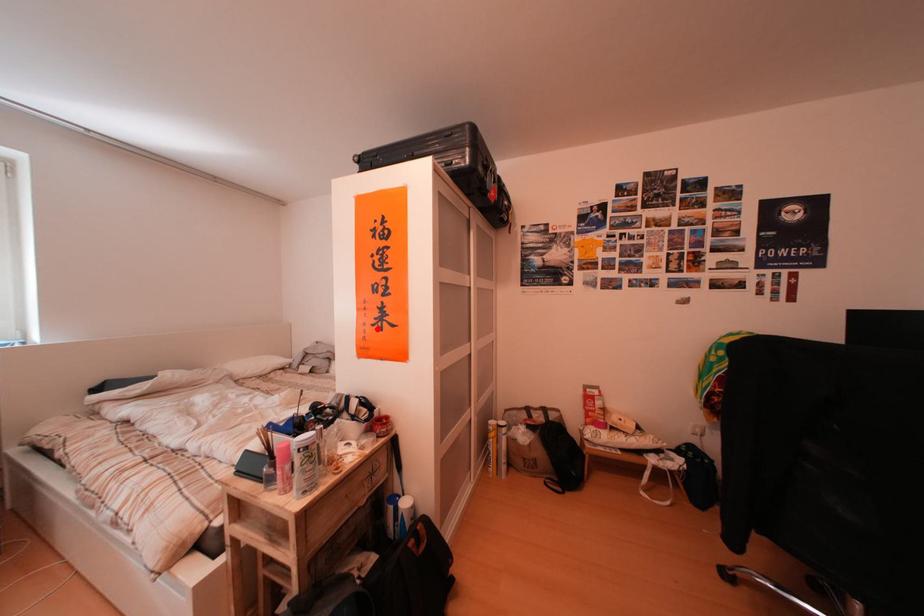
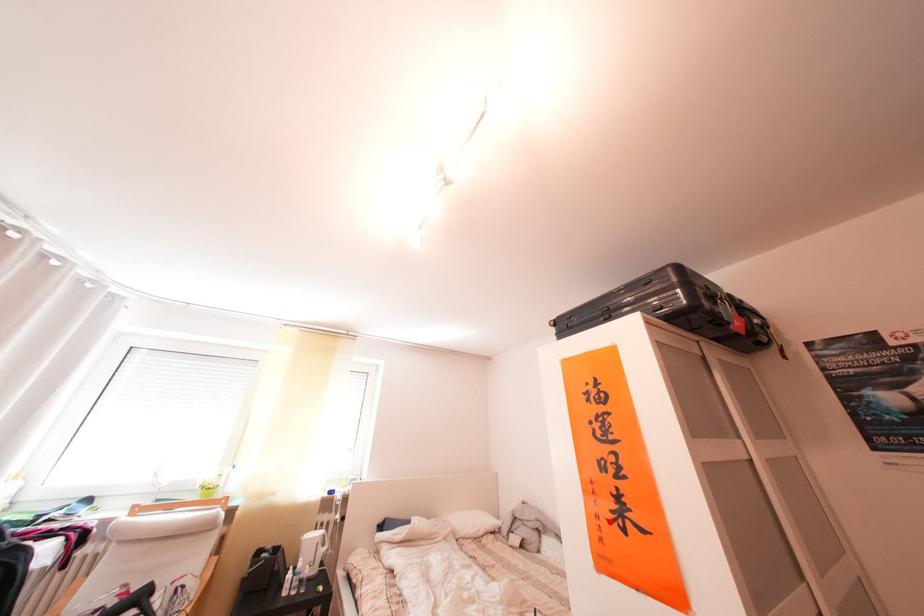
I am providing you with two images of the same scene from different viewpoints. A red point is marked on the first image and another point is marked on the second image. Do the highlighted points in image1 and image2 indicate the same real-world spot?

Yes